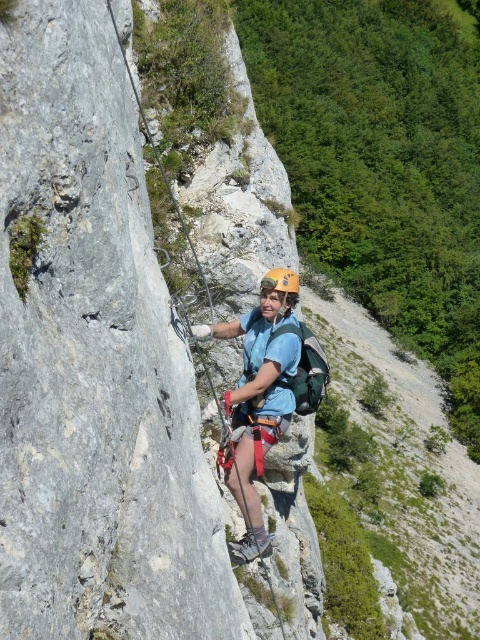
You are a photographer trying to capture the climber in the center of your camera frame. The camera has a crosshair at coordinates 0.5, 0.5. Is the matte blue shirt at center positioned to the left or right of the crosshair?

The matte blue shirt at center is positioned to the right of the crosshair since its 2D location is at point (257, 397), which is to the right of the center point (240, 320).

You are a safety inspector checking the climbing gear of the climber in the image. You notice the matte blue shirt at center and the yellow matte helmet at center. Which piece of clothing is shorter in height?

The matte blue shirt at center is shorter in height than the yellow matte helmet at center.

You are a safety inspector checking the climber in the image. You notice the matte blue shirt at center and the yellow matte helmet at center. According to safety protocols, which item should be visible at all times to ensure proper head protection?

The yellow matte helmet at center should be visible at all times because the matte blue shirt at center is in front of it, potentially obscuring the helmet and compromising head protection.